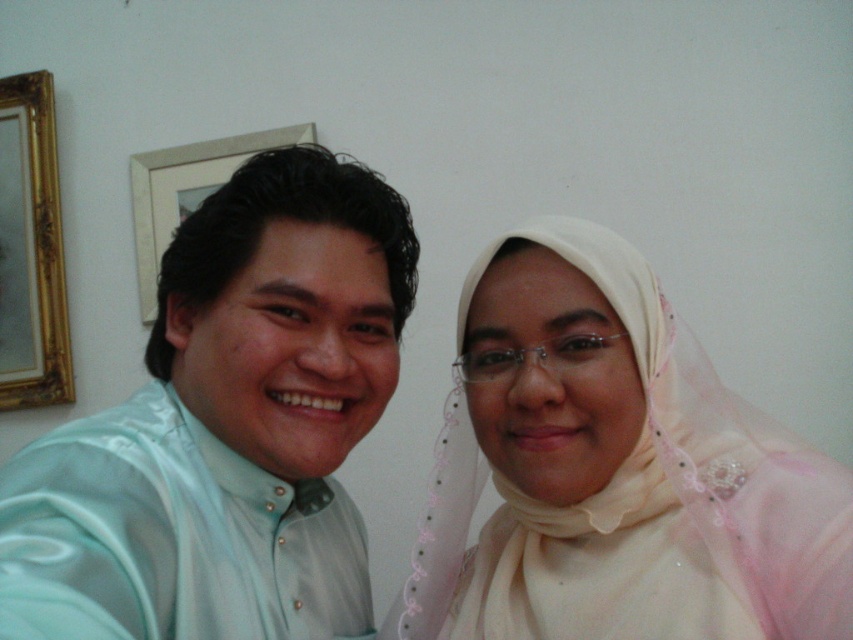
Find the location of `gold ornate mirror at upper left`. gold ornate mirror at upper left is located at coordinates (36, 241).

Does gold ornate mirror at upper left have a larger size compared to white matte picture frame at upper left?

Actually, gold ornate mirror at upper left might be smaller than white matte picture frame at upper left.

The width and height of the screenshot is (853, 640). I want to click on gold ornate mirror at upper left, so click(x=36, y=241).

In the scene shown: Can you confirm if light blue satin shirt at left is wider than light beige sheer hijab at center?

No.

Describe the element at coordinates (227, 428) in the screenshot. I see `light blue satin shirt at left` at that location.

The height and width of the screenshot is (640, 853). What are the coordinates of `light blue satin shirt at left` in the screenshot? It's located at (227, 428).

Locate an element on the screen. The width and height of the screenshot is (853, 640). light beige sheer hijab at center is located at coordinates (637, 504).

Based on the photo, is light beige sheer hijab at center bigger than gold ornate mirror at upper left?

Yes, light beige sheer hijab at center is bigger than gold ornate mirror at upper left.

Who is more forward, (x=595, y=516) or (x=25, y=230)?

Point (x=595, y=516)

Find the location of `light beige sheer hijab at center`. light beige sheer hijab at center is located at coordinates (637, 504).